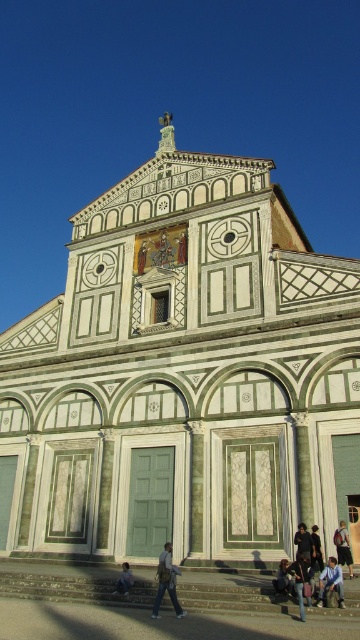
Question: Can you confirm if green marble stairs at lower center is wider than light blue jeans at lower center?

Choices:
 (A) no
 (B) yes

Answer: (B)

Question: Estimate the real-world distances between objects in this image. Which object is closer to the light blue jeans at lower center?

Choices:
 (A) dark blue jeans at lower center
 (B) jeans at lower center
 (C) dark brown leather jacket at lower center
 (D) blue denim jeans at lower right

Answer: (B)

Question: Which object appears farthest from the camera in this image?

Choices:
 (A) light blue jeans at lower center
 (B) denim pants at center
 (C) blue denim jeans at lower right
 (D) light blue denim jeans at lower center

Answer: (A)

Question: Which object is closer to the camera taking this photo?

Choices:
 (A) jeans at lower center
 (B) dark brown leather jacket at lower center
 (C) light blue jeans at lower center

Answer: (A)

Question: Is light blue denim jeans at lower center to the left of denim jacket at lower center from the viewer's perspective?

Choices:
 (A) yes
 (B) no

Answer: (B)

Question: Is jeans at lower center positioned before dark brown leather jacket at lower center?

Choices:
 (A) no
 (B) yes

Answer: (B)